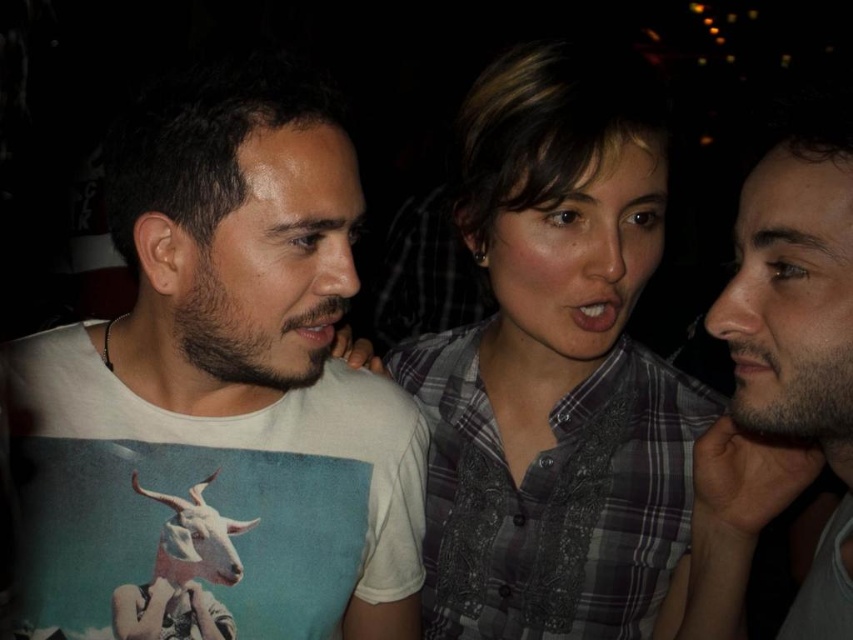
Question: Considering the real-world distances, which object is farthest from the plaid shirt at center?

Choices:
 (A) beige fabric shirt at center
 (B) white cotton t-shirt at left

Answer: (B)

Question: Which object appears farthest from the camera in this image?

Choices:
 (A) plaid shirt at center
 (B) beige fabric shirt at center
 (C) white cotton t-shirt at left

Answer: (A)

Question: Does plaid shirt at center have a greater width compared to beige fabric shirt at center?

Choices:
 (A) yes
 (B) no

Answer: (A)

Question: Which object is positioned closest to the white cotton t-shirt at left?

Choices:
 (A) plaid shirt at center
 (B) beige fabric shirt at center

Answer: (A)

Question: Does white cotton t-shirt at left have a lesser width compared to beige fabric shirt at center?

Choices:
 (A) yes
 (B) no

Answer: (B)

Question: Is white cotton t-shirt at left bigger than plaid shirt at center?

Choices:
 (A) yes
 (B) no

Answer: (A)